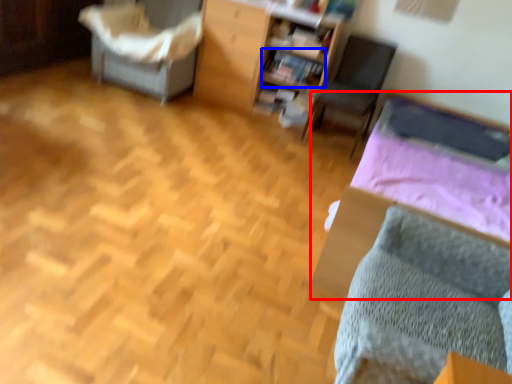
Question: Which point is further to the camera, bed (highlighted by a red box) or book (highlighted by a blue box)?

Choices:
 (A) bed
 (B) book

Answer: (B)